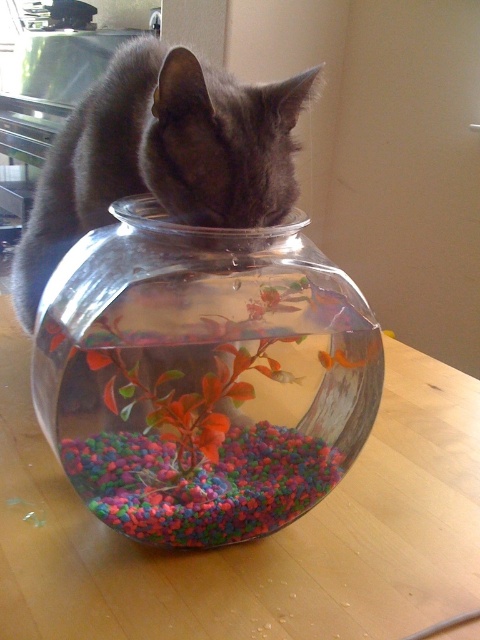
Question: From the image, what is the correct spatial relationship of wooden table at center in relation to orange matte fish at center?

Choices:
 (A) below
 (B) above

Answer: (A)

Question: Which of the following is the farthest from the observer?

Choices:
 (A) wooden table at center
 (B) transparent glass bowl at center
 (C) gray fur cat at upper center

Answer: (C)

Question: Which of the following is the closest to the observer?

Choices:
 (A) orange matte fish at center
 (B) gray fur cat at upper center
 (C) transparent glass bowl at center
 (D) wooden table at center

Answer: (D)

Question: Is wooden table at center to the left of orange matte fish at center from the viewer's perspective?

Choices:
 (A) yes
 (B) no

Answer: (A)

Question: Does gray fur cat at upper center have a larger size compared to orange matte fish at center?

Choices:
 (A) no
 (B) yes

Answer: (B)

Question: Considering the real-world distances, which object is farthest from the wooden table at center?

Choices:
 (A) orange matte fish at center
 (B) transparent glass bowl at center
 (C) gray fur cat at upper center

Answer: (C)